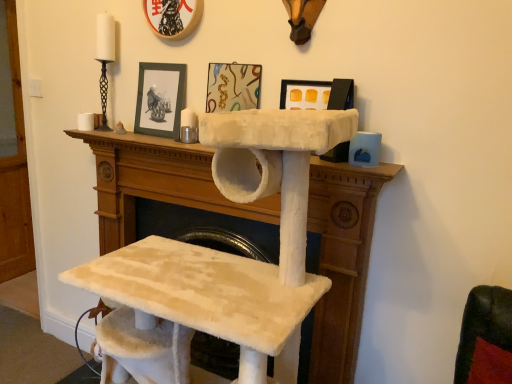
What do you see at coordinates (341, 261) in the screenshot? I see `white fluffy cat tree at center` at bounding box center [341, 261].

At what (x,y) coordinates should I click in order to perform the action: click on white fluffy cat tree at center. Please return your answer as a coordinate pair (x, y). Looking at the image, I should click on (341, 261).

Based on the photo, does matte black picture frame at upper center, which is the third picture frame in left-to-right order, have a greater width compared to matte plastic picture frame at upper center, which is the second picture frame from left to right?

Correct, the width of matte black picture frame at upper center, which is the third picture frame in left-to-right order, exceeds that of matte plastic picture frame at upper center, which is the second picture frame from left to right.

Considering the sizes of objects matte black picture frame at upper center, which is the third picture frame in left-to-right order, and matte plastic picture frame at upper center, which is the second picture frame from left to right, in the image provided, who is smaller, matte black picture frame at upper center, which is the third picture frame in left-to-right order, or matte plastic picture frame at upper center, which is the second picture frame from left to right,?

matte black picture frame at upper center, which is the third picture frame in left-to-right order.

Which point is more forward, (336, 89) or (217, 81)?

The point (336, 89) is in front.

Considering the relative sizes of matte black picture frame at upper center, which is counted as the first picture frame, starting from the right, and matte plastic picture frame at upper center, which is the second picture frame from left to right, in the image provided, is matte black picture frame at upper center, which is counted as the first picture frame, starting from the right, shorter than matte plastic picture frame at upper center, which is the second picture frame from left to right,?

Yes, matte black picture frame at upper center, which is counted as the first picture frame, starting from the right, is shorter than matte plastic picture frame at upper center, which is the second picture frame from left to right.

Based on the photo, which is in front, matte plastic picture frame at upper center, which is the second picture frame from left to right, or matte black picture frame at upper center, which is the third picture frame in left-to-right order?

matte black picture frame at upper center, which is the third picture frame in left-to-right order, is more forward.

Choose the correct answer: Is matte plastic picture frame at upper center, which ranks as the second picture frame in right-to-left order, inside matte black picture frame at upper center, which is the third picture frame in left-to-right order, or outside it?

matte plastic picture frame at upper center, which ranks as the second picture frame in right-to-left order, lies outside matte black picture frame at upper center, which is the third picture frame in left-to-right order.

Could you measure the distance between matte plastic picture frame at upper center, which is the second picture frame from left to right, and matte black picture frame at upper center, which is counted as the first picture frame, starting from the right?

matte plastic picture frame at upper center, which is the second picture frame from left to right, is 9.14 inches away from matte black picture frame at upper center, which is counted as the first picture frame, starting from the right.

Is matte plastic picture frame at upper center, which is the second picture frame from left to right, oriented away from matte black picture frame at upper center, which is the third picture frame in left-to-right order?

No.

From a real-world perspective, between black matte picture frame at upper center, the 1th picture frame from the left, and matte black picture frame at upper center, which is the third picture frame in left-to-right order, who is vertically higher?

black matte picture frame at upper center, the 1th picture frame from the left, from a real-world perspective.

Is point (183, 91) closer or farther from the camera than point (295, 106)?

Clearly, point (183, 91) is more distant from the camera than point (295, 106).

Is black matte picture frame at upper center, positioned as the 3th picture frame in right-to-left order, located outside matte black picture frame at upper center, which is the third picture frame in left-to-right order?

Indeed, black matte picture frame at upper center, positioned as the 3th picture frame in right-to-left order, is completely outside matte black picture frame at upper center, which is the third picture frame in left-to-right order.

Does black matte picture frame at upper center, positioned as the 3th picture frame in right-to-left order, appear on the left side of matte black picture frame at upper center, which is counted as the first picture frame, starting from the right?

Correct, you'll find black matte picture frame at upper center, positioned as the 3th picture frame in right-to-left order, to the left of matte black picture frame at upper center, which is counted as the first picture frame, starting from the right.

Which object is closer to the camera taking this photo, white fluffy cat tree at center or matte black picture frame at upper center, which is counted as the first picture frame, starting from the right?

white fluffy cat tree at center is in front.

From a real-world perspective, does white fluffy cat tree at center stand above matte black picture frame at upper center, which is the third picture frame in left-to-right order?

Actually, white fluffy cat tree at center is physically below matte black picture frame at upper center, which is the third picture frame in left-to-right order, in the real world.

Is white fluffy cat tree at center far from matte black picture frame at upper center, which is counted as the first picture frame, starting from the right?

No, white fluffy cat tree at center is not far from matte black picture frame at upper center, which is counted as the first picture frame, starting from the right.

In the image, is matte black picture frame at upper center, which is the third picture frame in left-to-right order, on the left side or the right side of white fluffy cat tree at center?

matte black picture frame at upper center, which is the third picture frame in left-to-right order, is to the right of white fluffy cat tree at center.

Based on the photo, is there a large distance between matte black picture frame at upper center, which is counted as the first picture frame, starting from the right, and white fluffy cat tree at center?

matte black picture frame at upper center, which is counted as the first picture frame, starting from the right, is near white fluffy cat tree at center, not far away.

Consider the image. Relative to white fluffy cat tree at center, is matte black picture frame at upper center, which is counted as the first picture frame, starting from the right, in front or behind?

Visually, matte black picture frame at upper center, which is counted as the first picture frame, starting from the right, is located behind white fluffy cat tree at center.

At what (x,y) coordinates should I click in order to perform the action: click on the 1st picture frame above when counting from the white fluffy cat tree at center (from the image's perspective). Please return your answer as a coordinate pair (x, y). Image resolution: width=512 pixels, height=384 pixels. Looking at the image, I should click on (317, 94).

From the image's perspective, between matte plastic picture frame at upper center, which is the second picture frame from left to right, and white fluffy cat tree at center, who is located below?

white fluffy cat tree at center appears lower in the image.

Is matte plastic picture frame at upper center, which is the second picture frame from left to right, far away from white fluffy cat tree at center?

matte plastic picture frame at upper center, which is the second picture frame from left to right, is near white fluffy cat tree at center, not far away.

Which is more to the right, matte plastic picture frame at upper center, which ranks as the second picture frame in right-to-left order, or white fluffy cat tree at center?

matte plastic picture frame at upper center, which ranks as the second picture frame in right-to-left order.

Does point (247, 106) lie behind point (116, 248)?

No, it is not.

Could black matte picture frame at upper center, positioned as the 3th picture frame in right-to-left order, be considered to be inside matte plastic picture frame at upper center, which ranks as the second picture frame in right-to-left order?

Actually, black matte picture frame at upper center, positioned as the 3th picture frame in right-to-left order, is outside matte plastic picture frame at upper center, which ranks as the second picture frame in right-to-left order.

Which point is more distant from viewer, (255, 65) or (166, 124)?

The point (166, 124) is farther from the camera.

Can you tell me how much matte plastic picture frame at upper center, which ranks as the second picture frame in right-to-left order, and black matte picture frame at upper center, the 1th picture frame from the left, differ in facing direction?

There is a 2.18-degree angle between the facing directions of matte plastic picture frame at upper center, which ranks as the second picture frame in right-to-left order, and black matte picture frame at upper center, the 1th picture frame from the left.

Which object is closer to the camera taking this photo, matte plastic picture frame at upper center, which is the second picture frame from left to right, or black matte picture frame at upper center, positioned as the 3th picture frame in right-to-left order?

matte plastic picture frame at upper center, which is the second picture frame from left to right, is closer to the camera.

The height and width of the screenshot is (384, 512). I want to click on the 1st picture frame counting from the left side of the matte black picture frame at upper center, which is the third picture frame in left-to-right order, so click(232, 86).

Where is `picture frame located on the right of matte plastic picture frame at upper center, which is the second picture frame from left to right`? picture frame located on the right of matte plastic picture frame at upper center, which is the second picture frame from left to right is located at coordinates (317, 94).

When comparing their distances from white fluffy cat tree at center, does black matte picture frame at upper center, positioned as the 3th picture frame in right-to-left order, or matte black picture frame at upper center, which is the third picture frame in left-to-right order, seem closer?

black matte picture frame at upper center, positioned as the 3th picture frame in right-to-left order.

Estimate the real-world distances between objects in this image. Which object is further from matte plastic picture frame at upper center, which ranks as the second picture frame in right-to-left order, black matte picture frame at upper center, positioned as the 3th picture frame in right-to-left order, or white fluffy cat tree at center?

The object further to matte plastic picture frame at upper center, which ranks as the second picture frame in right-to-left order, is white fluffy cat tree at center.

Considering their positions, is black matte picture frame at upper center, the 1th picture frame from the left, positioned further to matte black picture frame at upper center, which is the third picture frame in left-to-right order, than matte plastic picture frame at upper center, which ranks as the second picture frame in right-to-left order?

black matte picture frame at upper center, the 1th picture frame from the left, is positioned further to the anchor matte black picture frame at upper center, which is the third picture frame in left-to-right order.

Based on their spatial positions, is matte black picture frame at upper center, which is counted as the first picture frame, starting from the right, or matte plastic picture frame at upper center, which ranks as the second picture frame in right-to-left order, closer to black matte picture frame at upper center, the 1th picture frame from the left?

matte plastic picture frame at upper center, which ranks as the second picture frame in right-to-left order.

Based on their spatial positions, is white fluffy cat tree at center or black matte picture frame at upper center, positioned as the 3th picture frame in right-to-left order, further from matte plastic picture frame at upper center, which ranks as the second picture frame in right-to-left order?

white fluffy cat tree at center is further to matte plastic picture frame at upper center, which ranks as the second picture frame in right-to-left order.

Looking at the image, which one is located closer to black matte picture frame at upper center, the 1th picture frame from the left, matte plastic picture frame at upper center, which is the second picture frame from left to right, or white fluffy cat tree at center?

The object closer to black matte picture frame at upper center, the 1th picture frame from the left, is matte plastic picture frame at upper center, which is the second picture frame from left to right.

Consider the image. Based on their spatial positions, is white fluffy cat tree at center or matte plastic picture frame at upper center, which ranks as the second picture frame in right-to-left order, further from matte black picture frame at upper center, which is counted as the first picture frame, starting from the right?

white fluffy cat tree at center lies further to matte black picture frame at upper center, which is counted as the first picture frame, starting from the right, than the other object.

Based on their spatial positions, is white fluffy cat tree at center or matte black picture frame at upper center, which is counted as the first picture frame, starting from the right, closer to matte plastic picture frame at upper center, which is the second picture frame from left to right?

matte black picture frame at upper center, which is counted as the first picture frame, starting from the right, is positioned closer to the anchor matte plastic picture frame at upper center, which is the second picture frame from left to right.

Identify the location of picture frame situated between black matte picture frame at upper center, the 1th picture frame from the left, and matte black picture frame at upper center, which is the third picture frame in left-to-right order, from left to right. The image size is (512, 384). (232, 86).

Find the location of a particular element. picture frame between matte plastic picture frame at upper center, which ranks as the second picture frame in right-to-left order, and white fluffy cat tree at center, in the vertical direction is located at coordinates (317, 94).